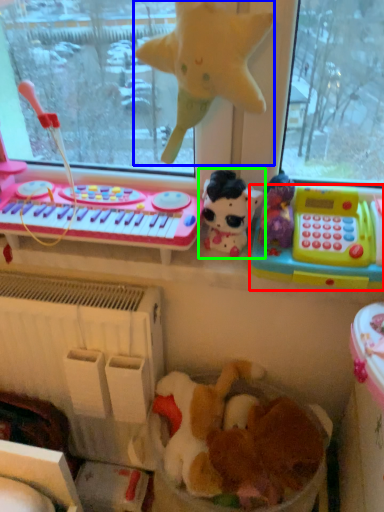
Question: Which object is positioned closest to toy (highlighted by a red box)? Select from toy (highlighted by a blue box) and toy (highlighted by a green box).

Choices:
 (A) toy
 (B) toy

Answer: (B)